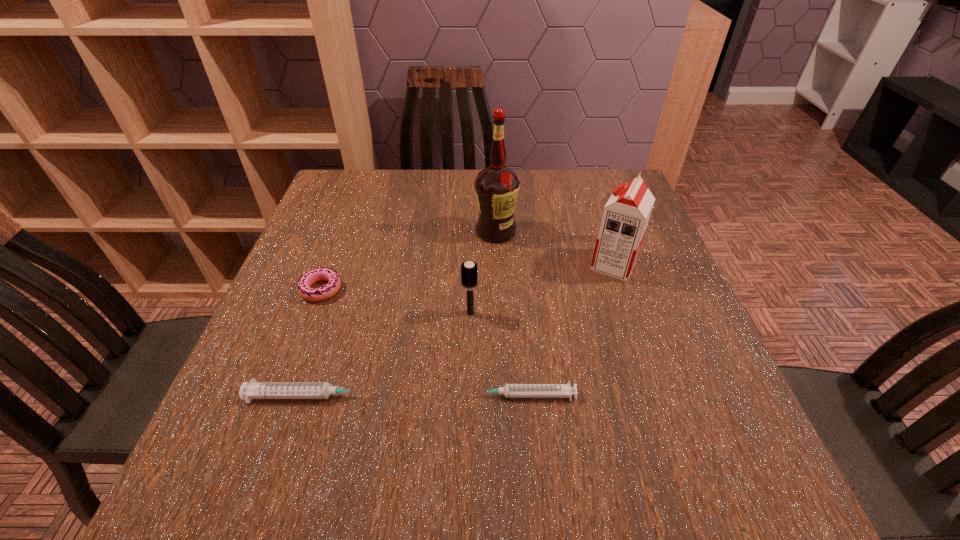
The height and width of the screenshot is (540, 960). I want to click on blank space located at the needle end of the shorter syringe, so click(x=296, y=395).

Where is `vacant region located at the needle end of the shorter syringe`? vacant region located at the needle end of the shorter syringe is located at coordinates (301, 395).

Where is `vacant space located 0.320m at the needle end of the shorter syringe`? This screenshot has width=960, height=540. vacant space located 0.320m at the needle end of the shorter syringe is located at coordinates (290, 395).

The image size is (960, 540). I want to click on vacant space situated 0.400m on the label of the farthest object, so click(x=502, y=381).

In order to click on vacant area situated on the front of the soya milk in this screenshot , I will do `click(665, 419)`.

Identify the location of vacant area located on the back of the doughnut. pyautogui.click(x=360, y=186).

At what (x,y) coordinates should I click in order to perform the action: click on blank space located 0.250m on the front of the fourth shortest object. Please return your answer as a coordinate pair (x, y). Image resolution: width=960 pixels, height=540 pixels. Looking at the image, I should click on (468, 432).

The height and width of the screenshot is (540, 960). In order to click on syringe located at the left edge in this screenshot , I will do `click(253, 390)`.

At what (x,y) coordinates should I click in order to perform the action: click on doughnut present at the left edge. Please return your answer as a coordinate pair (x, y). Looking at the image, I should click on (310, 277).

At what (x,y) coordinates should I click in order to perform the action: click on object situated at the right edge. Please return your answer as a coordinate pair (x, y). Looking at the image, I should click on (625, 217).